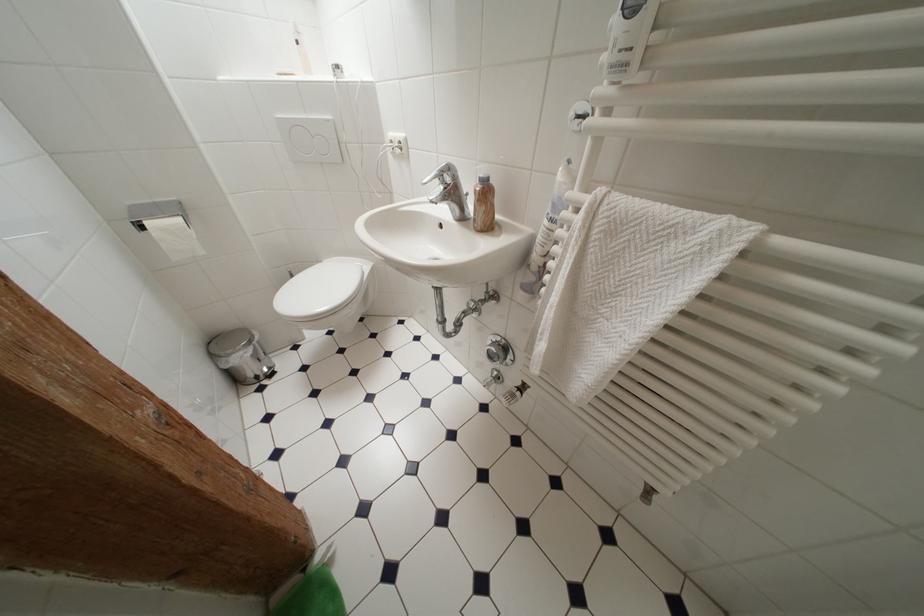
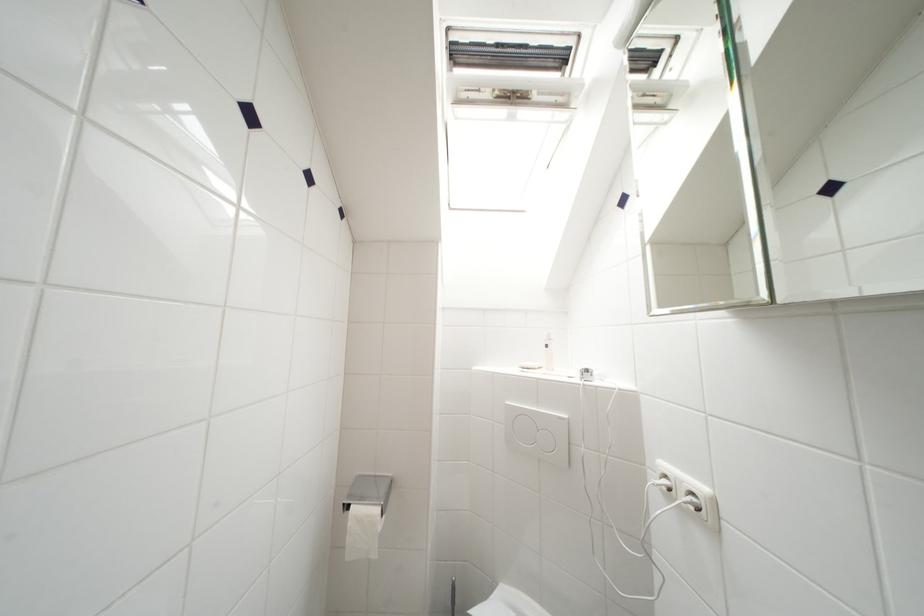
Where in the second image is the point corresponding to point (147, 229) from the first image?

(354, 512)